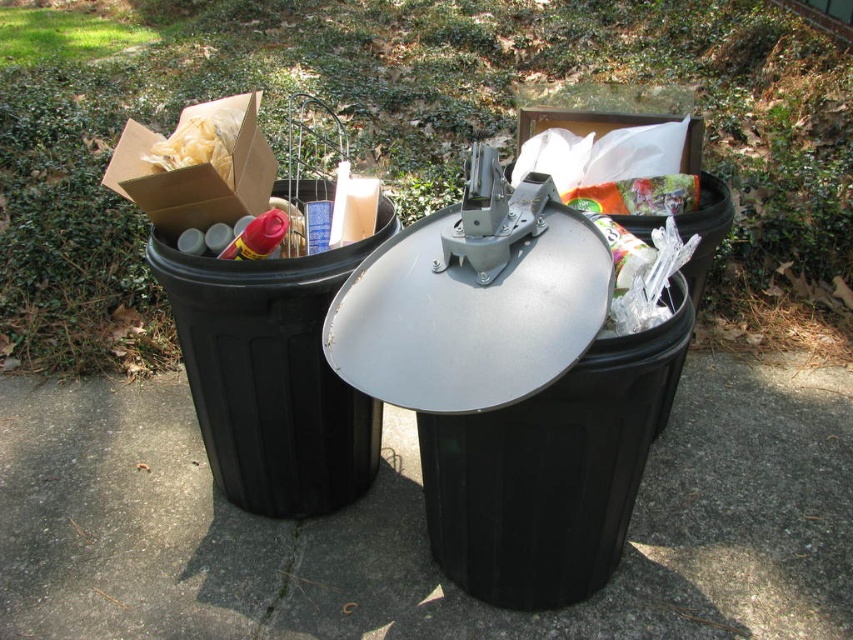
You are trying to place a large pizza box that is 18 inches wide. You see the black plastic bin at left and the clear plastic bag at center. Which container can fit the pizza box based on their widths?

The black plastic bin at left might be wider than clear plastic bag at center, so it is more likely to fit the pizza box.

Based on the photo, you are a gardener who needs to dispose of a large gardening tool. You see the black plastic bin at left and the clear plastic bag at center. Which container can hold the tool based on their sizes?

The black plastic bin at left is bigger than the clear plastic bag at center, so it can hold the large gardening tool.